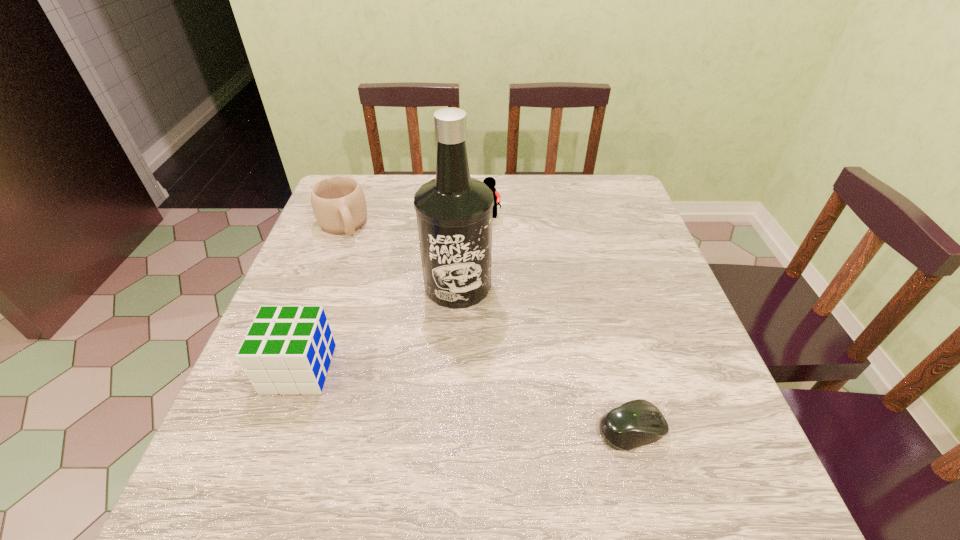
Where is `the third closest object to the liquor`? The image size is (960, 540). the third closest object to the liquor is located at coordinates coord(338,202).

What are the coordinates of `object identified as the fourth closest to the fourth farthest object` in the screenshot? It's located at (489, 181).

At what (x,y) coordinates should I click in order to perform the action: click on vacant area that satisfies the following two spatial constraints: 1. on the front side of the Lego; 2. on the right side of the nearest object. Please return your answer as a coordinate pair (x, y). This screenshot has height=540, width=960. Looking at the image, I should click on (492, 429).

Find the location of a particular element. This screenshot has height=540, width=960. free location that satisfies the following two spatial constraints: 1. on the front side of the mug; 2. on the right side of the mouse is located at coordinates (264, 429).